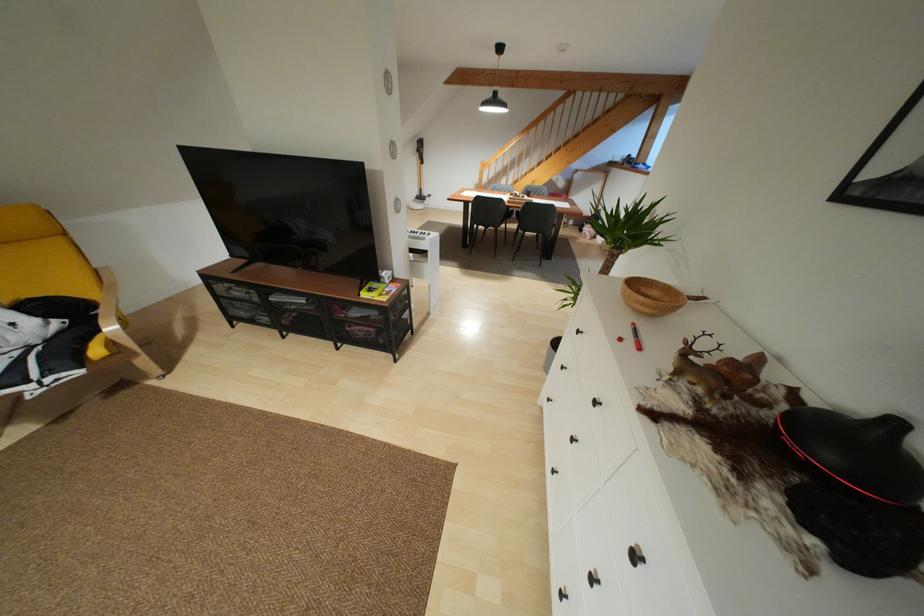
Find where to lift the small yellow box. Please return your answer as a coordinate pair (x, y).

(372, 290)